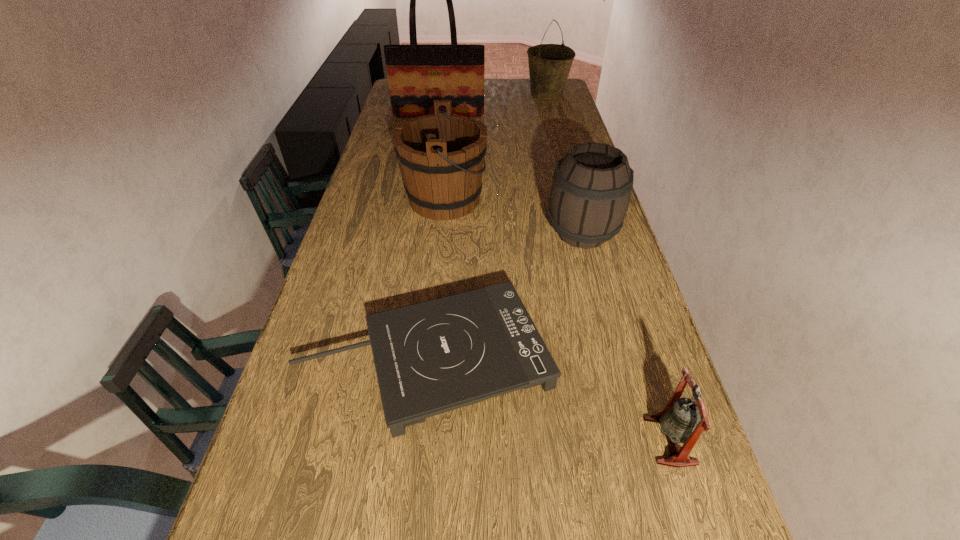
In order to click on the tallest object in this screenshot , I will do `click(417, 75)`.

Find the location of a particular element. the second farthest object is located at coordinates (417, 75).

The width and height of the screenshot is (960, 540). What are the coordinates of `the farthest wine bucket` in the screenshot? It's located at (549, 64).

Identify the location of the leftmost wine bucket. The height and width of the screenshot is (540, 960). (441, 156).

I want to click on bell, so click(x=680, y=422).

The image size is (960, 540). Find the location of `the shortest object`. the shortest object is located at coordinates (431, 357).

The width and height of the screenshot is (960, 540). In order to click on vacant space located on the front-facing side of the second farthest object in this screenshot , I will do `click(437, 127)`.

This screenshot has width=960, height=540. Identify the location of vacant space located 0.160m on the front of the farthest wine bucket. (554, 119).

This screenshot has height=540, width=960. I want to click on vacant area situated on the side of the leftmost wine bucket with the handle for carrying, so click(537, 199).

Identify the location of vacant space located on the left of the bell. This screenshot has height=540, width=960. 488,441.